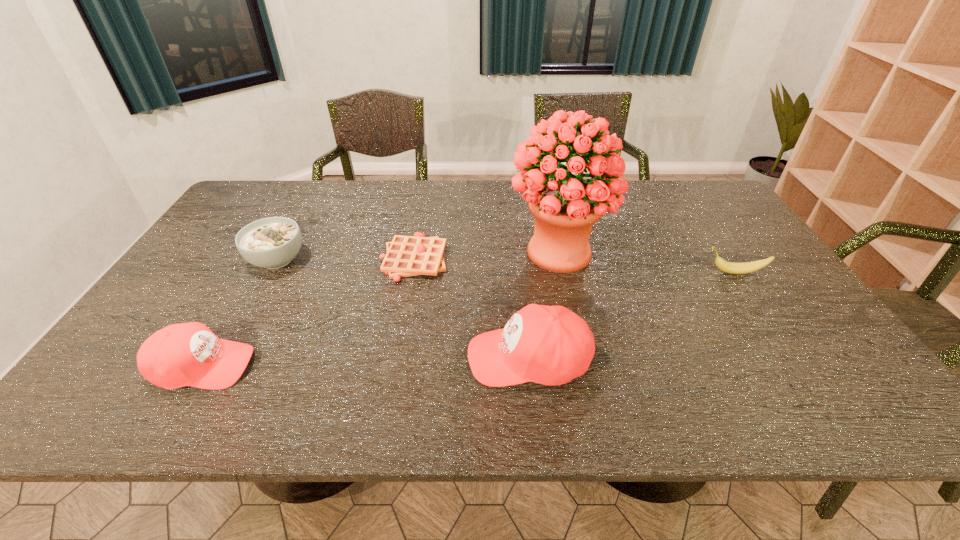
This screenshot has height=540, width=960. I want to click on the shorter baseball cap, so click(188, 354).

This screenshot has width=960, height=540. What are the coordinates of `the right baseball cap` in the screenshot? It's located at (551, 345).

In order to click on the taller baseball cap in this screenshot , I will do (551, 345).

The width and height of the screenshot is (960, 540). Find the location of `waffle`. waffle is located at coordinates (406, 256).

Where is `the shortest object`? the shortest object is located at coordinates (406, 256).

Find the location of a particular element. The height and width of the screenshot is (540, 960). bouquet is located at coordinates (565, 209).

Where is `the second shortest object`? the second shortest object is located at coordinates coord(734,268).

This screenshot has height=540, width=960. What are the coordinates of `the rightmost object` in the screenshot? It's located at (734, 268).

Find the location of a particular element. This screenshot has width=960, height=540. soup bowl is located at coordinates (272, 242).

This screenshot has height=540, width=960. I want to click on vacant region located 0.350m on the front panel of the shorter baseball cap, so click(408, 367).